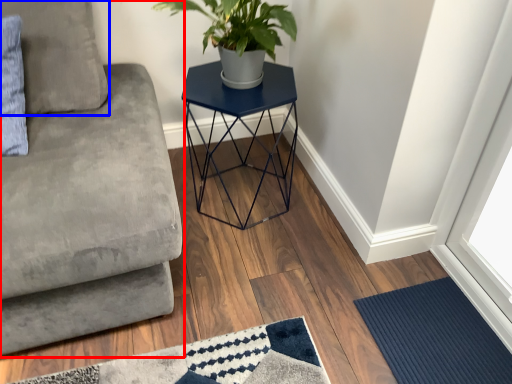
Question: Which of the following is the closest to the observer, studio couch (highlighted by a red box) or pillow (highlighted by a blue box)?

Choices:
 (A) studio couch
 (B) pillow

Answer: (A)